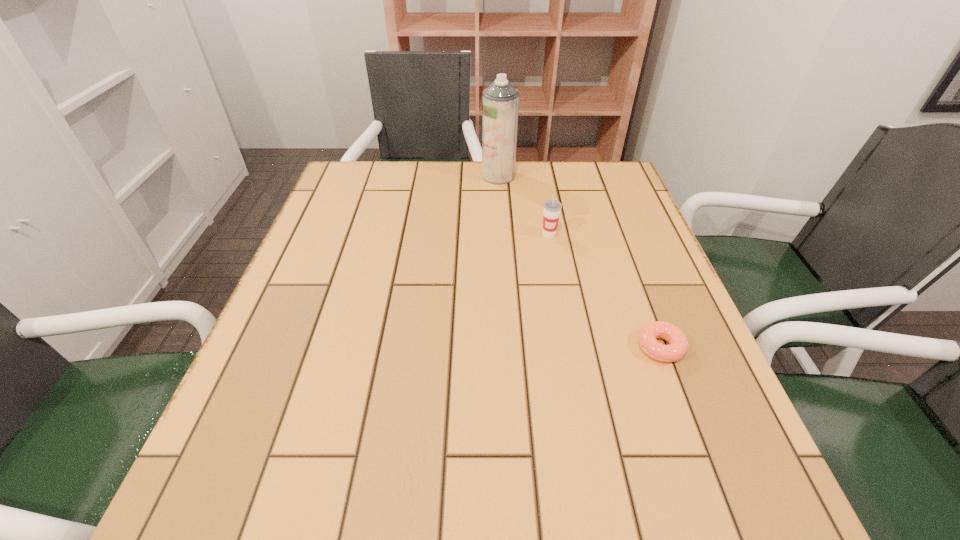
The width and height of the screenshot is (960, 540). Find the location of `empty space that is in between the leftmost object and the rightmost object`. empty space that is in between the leftmost object and the rightmost object is located at coordinates (580, 261).

This screenshot has width=960, height=540. Identify the location of unoccupied area between the farthest object and the second object from right to left. (524, 205).

In order to click on vacant region between the second shortest object and the nearest object in this screenshot , I will do `click(605, 291)`.

The height and width of the screenshot is (540, 960). Identify the location of unoccupied position between the second object from left to right and the tallest object. (524, 205).

Locate an element on the screen. This screenshot has height=540, width=960. unoccupied position between the nearest object and the aerosol can is located at coordinates (580, 261).

Locate an element on the screen. This screenshot has height=540, width=960. vacant space that is in between the shortest object and the farthest object is located at coordinates (580, 261).

Image resolution: width=960 pixels, height=540 pixels. What are the coordinates of `object that is the closest to the rightmost object` in the screenshot? It's located at (552, 208).

Select which object appears as the second closest to the leftmost object. Please provide its 2D coordinates. Your answer should be formatted as a tuple, i.e. [(x, y)], where the tuple contains the x and y coordinates of a point satisfying the conditions above.

[(678, 344)]

Identify the location of free space that satisfies the following two spatial constraints: 1. on the side of the second shortest object with the logo; 2. on the left side of the doughnut. This screenshot has height=540, width=960. (570, 347).

Where is `vacant space that satisfies the following two spatial constraints: 1. on the front side of the shortest object; 2. on the right side of the farthest object`? vacant space that satisfies the following two spatial constraints: 1. on the front side of the shortest object; 2. on the right side of the farthest object is located at coordinates (509, 347).